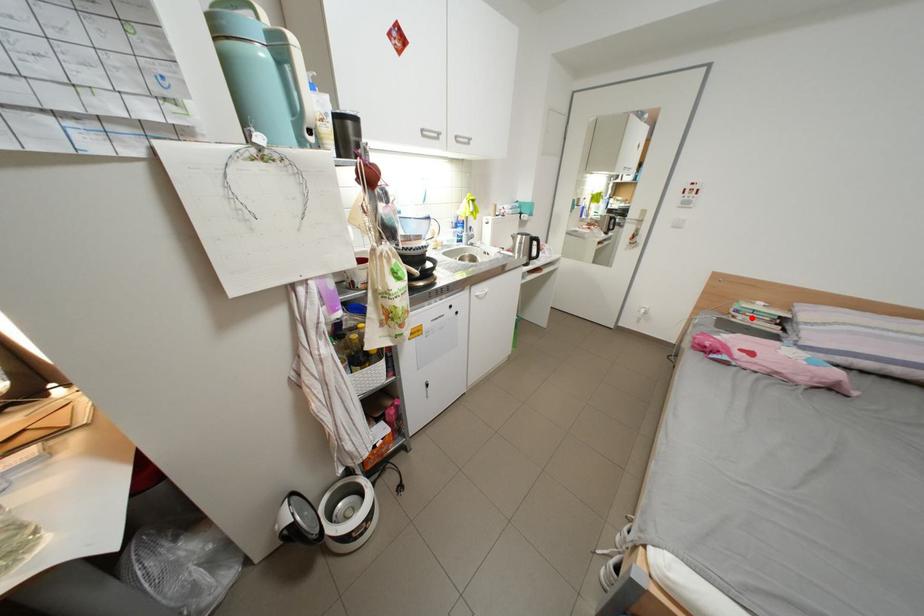
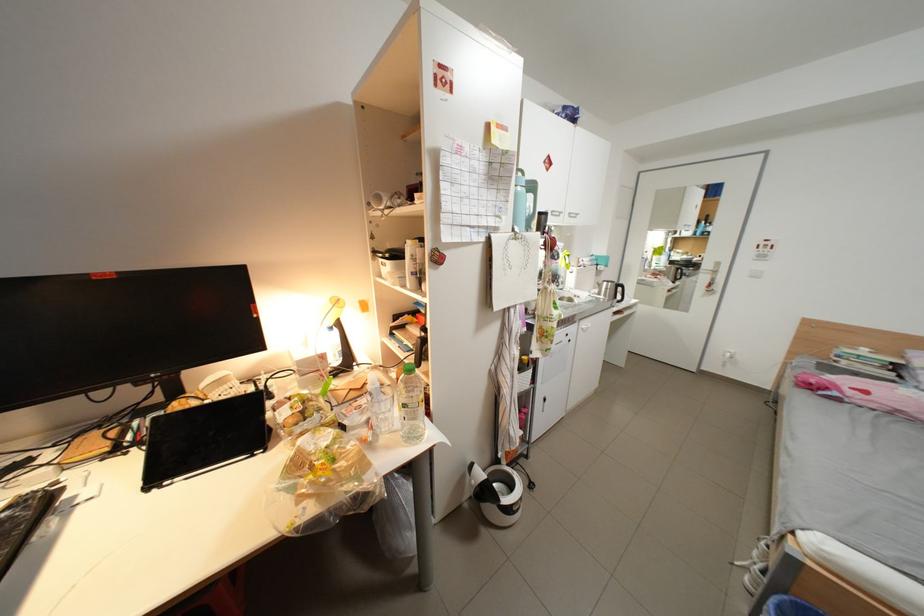
Question: I am providing you with two images of the same scene from different viewpoints. A red point is shown in image1. For the corresponding object point in image2, is it positioned nearer or farther from the camera?

Choices:
 (A) Nearer
 (B) Farther

Answer: (B)